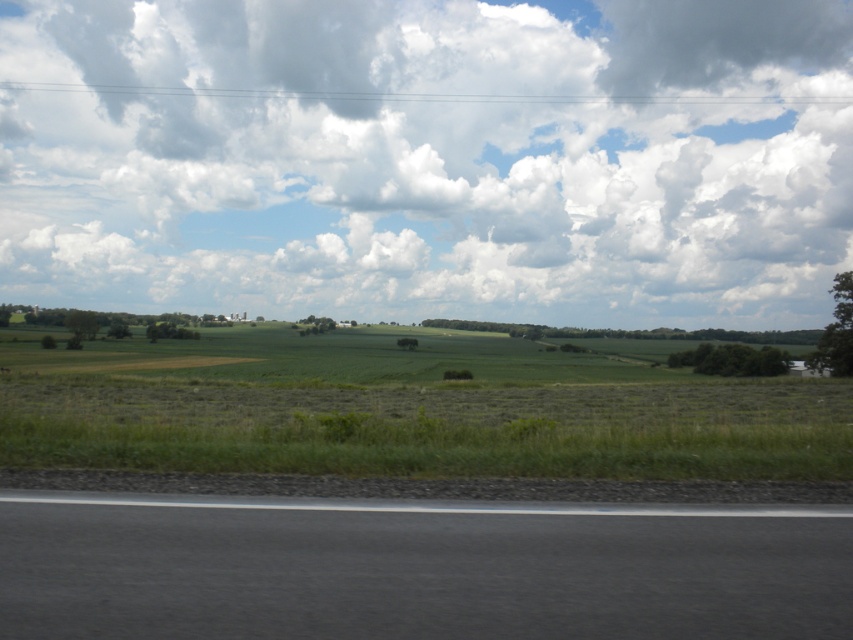
You are driving a car and see the black asphalt road at lower center and the green grassland at lower left. Which one is closer to you?

The black asphalt road at lower center is closer to you because it is in front of the green grassland at lower left.

In the scene shown: You are driving along the black asphalt road at lower center and want to turn left into the green grassy field at center. Is the road positioned in a way that allows for a safe left turn into the field?

The black asphalt road at lower center is to the right of the green grassy field at center, so turning left from the road towards the field would require crossing into the field from the right side, which may not be safe or advisable without proper access points.